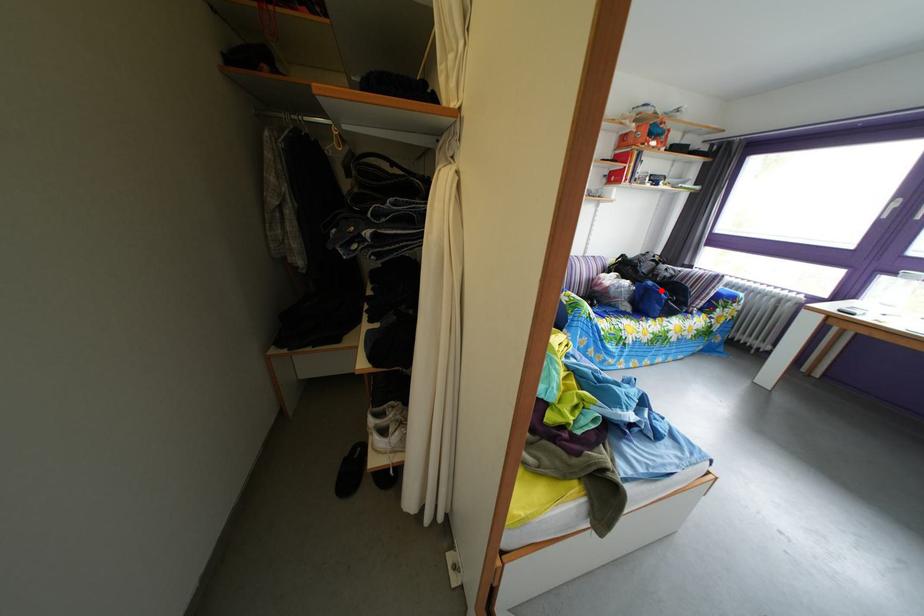
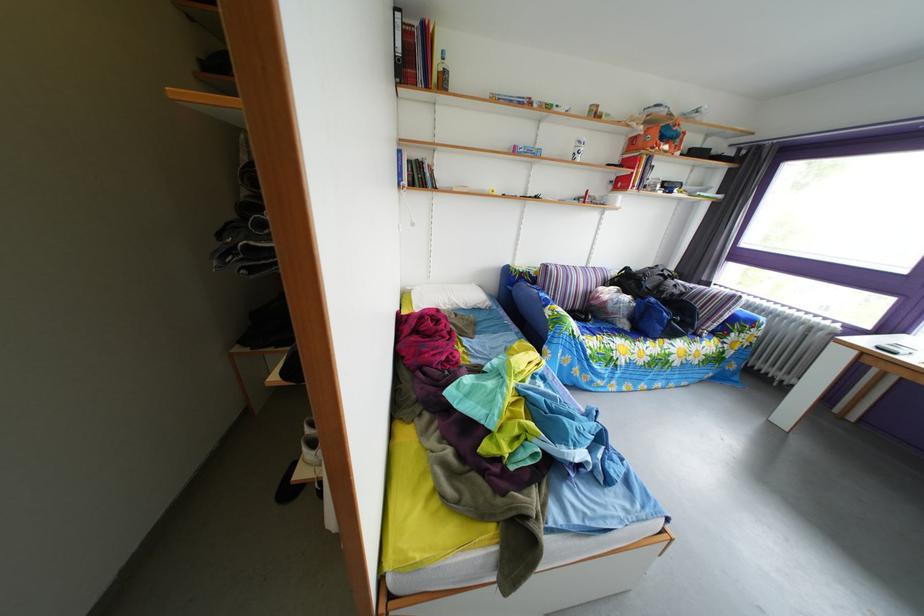
Locate, in the second image, the point that corresponds to the highlighted location in the first image.

(663, 307)